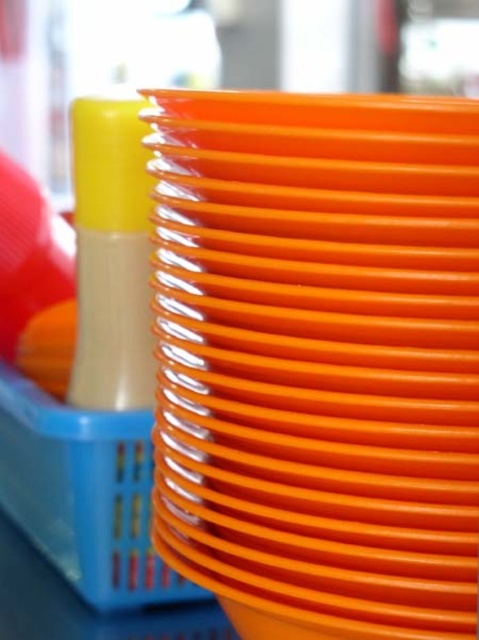
Does point (300, 108) lie in front of point (82, 452)?

Yes, it is.

Image resolution: width=479 pixels, height=640 pixels. Find the location of `orange plastic plate at center`. orange plastic plate at center is located at coordinates click(319, 358).